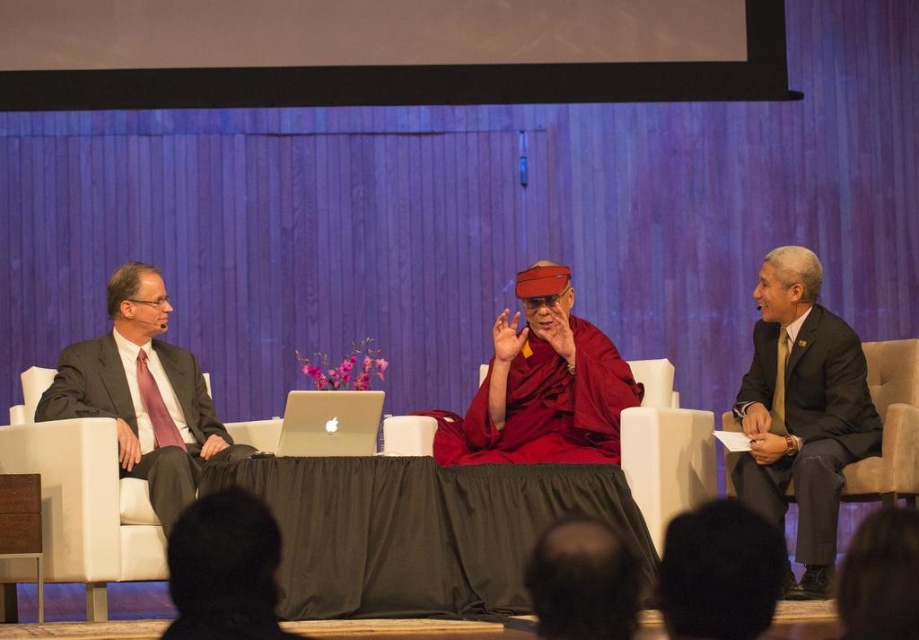
You are an event organizer who needs to adjust seating arrangements. The dark gray suit at left and the silver metallic laptop at center are currently placed in a way that might block the view of the audience. Considering their sizes, which object should be moved to ensure better visibility?

The dark gray suit at left is much taller than the silver metallic laptop at center, so moving the dark gray suit at left would improve visibility for the audience.

You are an event organizer who needs to adjust the setup for a presentation. You see the black fabric table at center and the silver metallic laptop at center. Which object is positioned lower in the scene?

The black fabric table at center is located below the silver metallic laptop at center, so it is positioned lower in the scene.